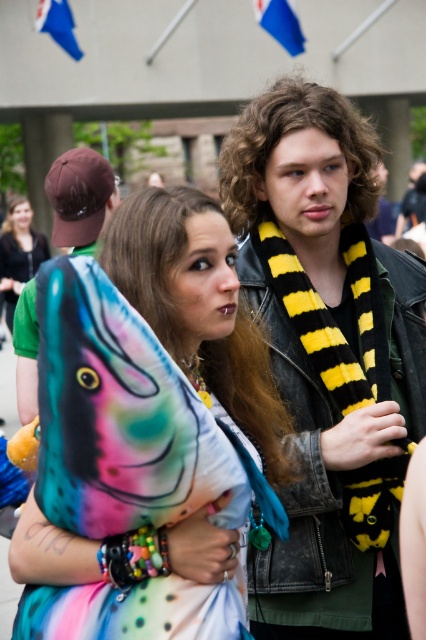
Based on the photo, you are standing in the center of the scene and want to place a new decorative item exactly where the multicolored plush fish at center is currently located. According to the coordinates provided, what are the exact coordinates where you should place the new item?

The exact coordinates to place the new item would be at point (149, 420), where the multicolored plush fish at center is currently positioned.